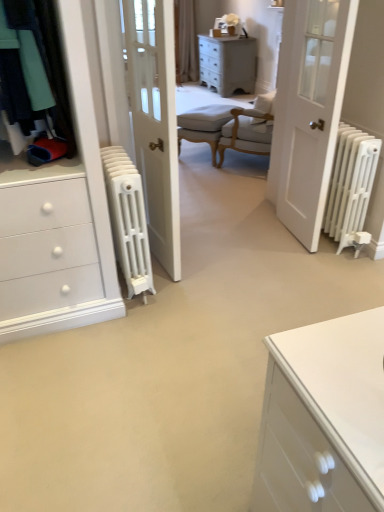
Where is `free space to the left of white matte radiator at right`? free space to the left of white matte radiator at right is located at coordinates 248,238.